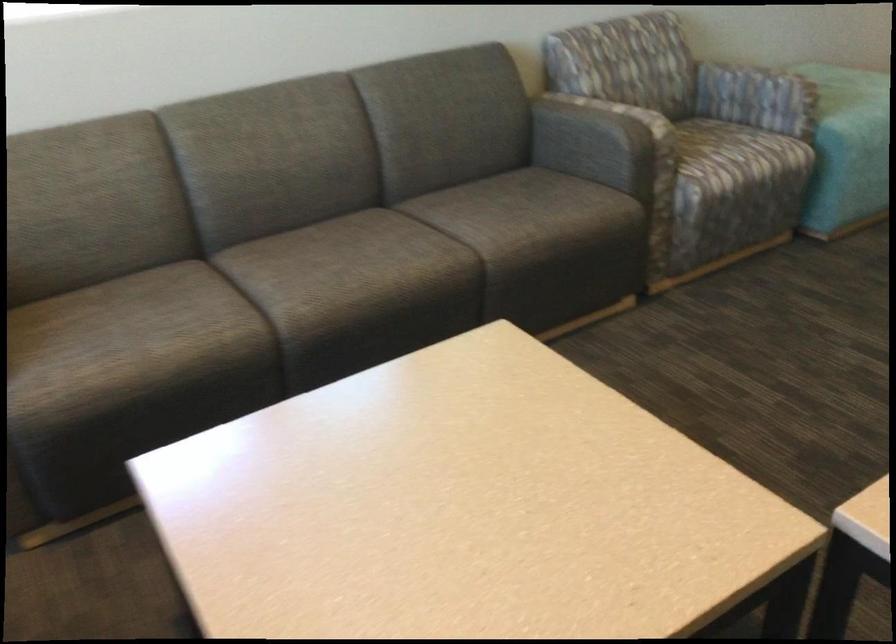
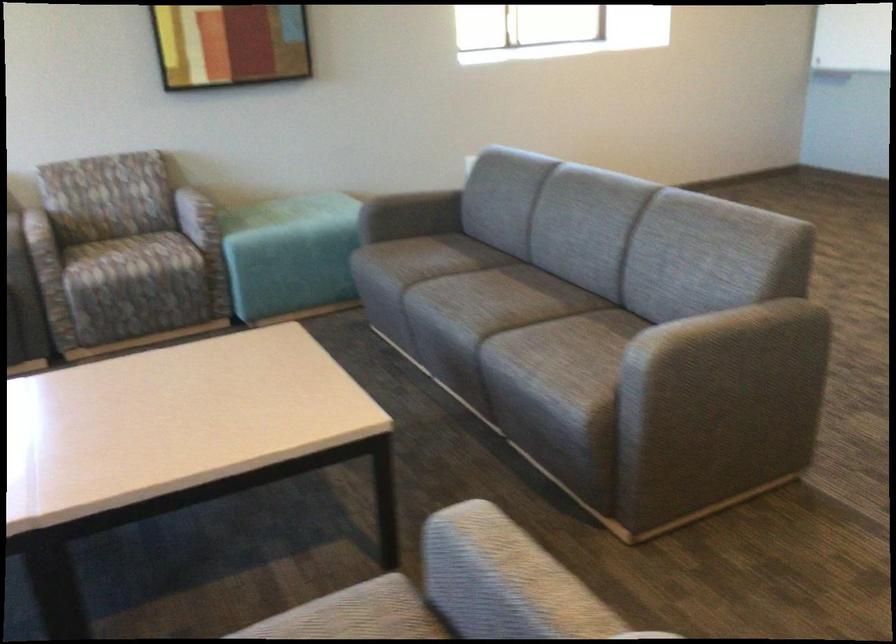
Find the pixel in the second image that matches [704,147] in the first image.

(125, 259)